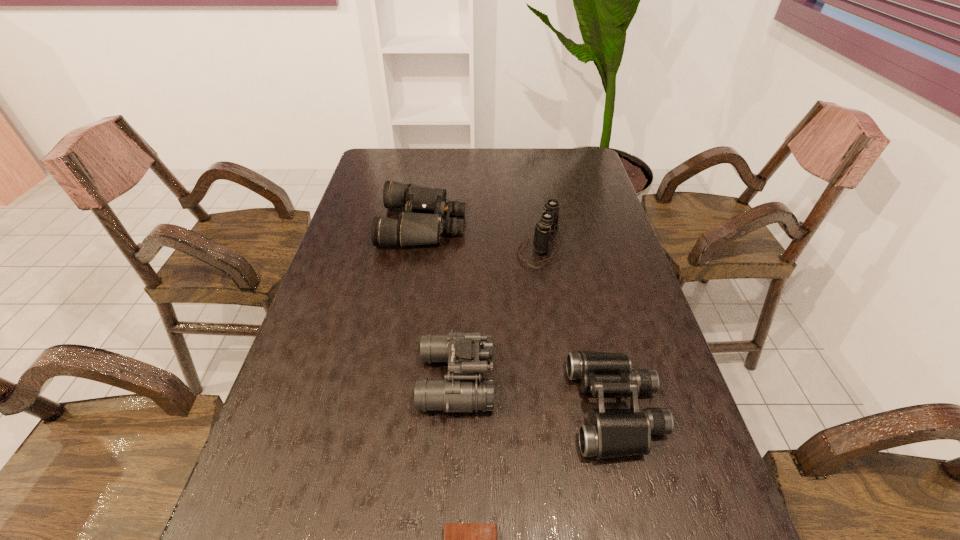
Select which binoculars is the third closest to the shortest object. Please provide its 2D coordinates. Your answer should be formatted as a tuple, i.e. [(x, y)], where the tuple contains the x and y coordinates of a point satisfying the conditions above.

[(549, 222)]